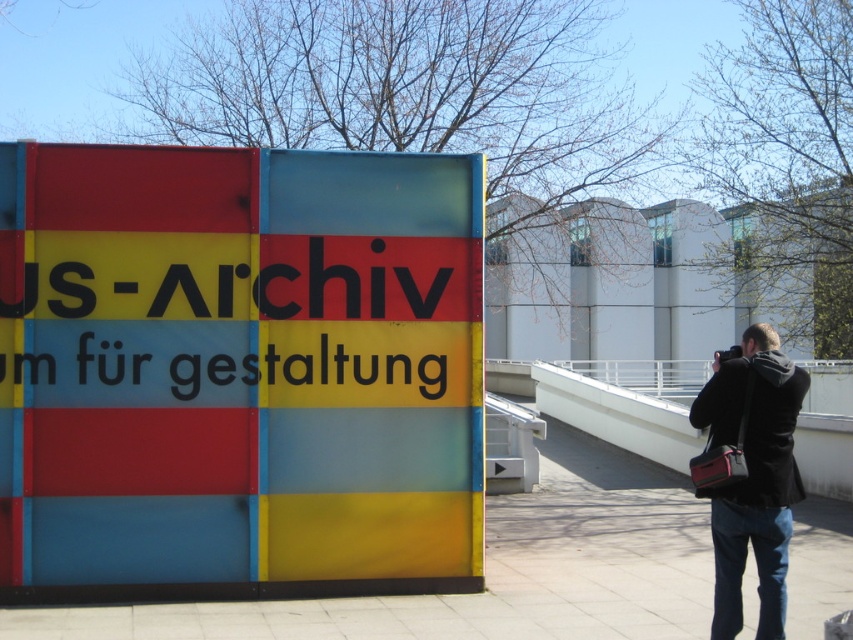
Question: Where is matte plastic sign at center located in relation to black fabric camera bag at lower right in the image?

Choices:
 (A) above
 (B) below

Answer: (A)

Question: Which point is farther from the camera taking this photo?

Choices:
 (A) (743, 376)
 (B) (126, 561)

Answer: (B)

Question: Which point is farther to the camera?

Choices:
 (A) (77, 420)
 (B) (717, 554)

Answer: (A)

Question: Does matte plastic sign at center have a lesser width compared to black fabric camera bag at lower right?

Choices:
 (A) yes
 (B) no

Answer: (B)

Question: Does matte plastic sign at center lie in front of black fabric camera bag at lower right?

Choices:
 (A) no
 (B) yes

Answer: (A)